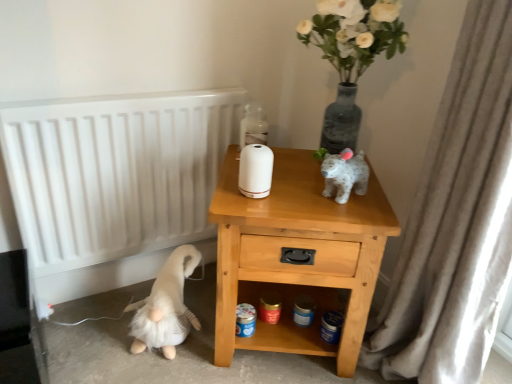
The height and width of the screenshot is (384, 512). In order to click on vacant area that is in front of white plush gnome at lower left in this screenshot , I will do `click(143, 370)`.